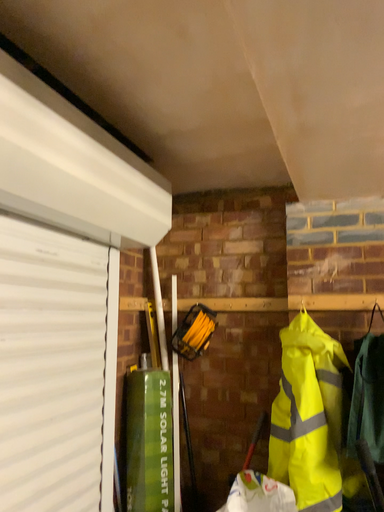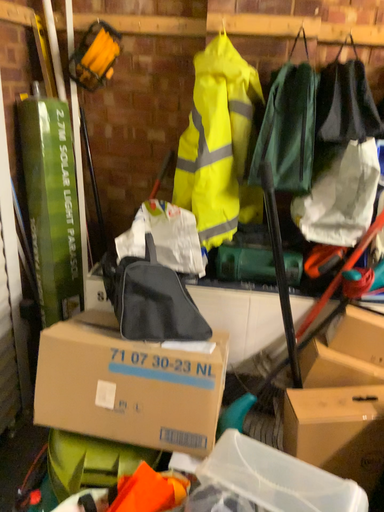
Question: Which way did the camera rotate in the video?

Choices:
 (A) rotated downward
 (B) rotated upward

Answer: (A)